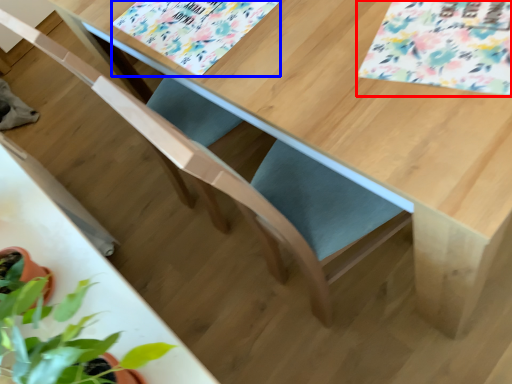
Question: Which of the following is the farthest to the observer, flower (highlighted by a red box) or flower (highlighted by a blue box)?

Choices:
 (A) flower
 (B) flower

Answer: (B)